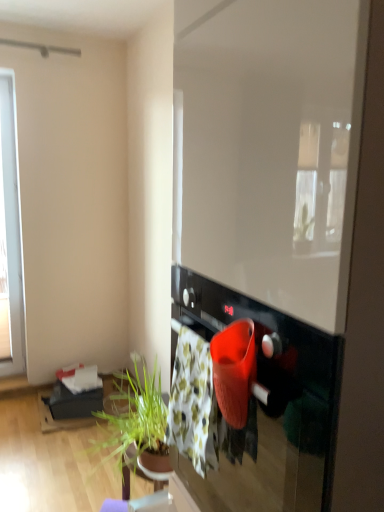
Question: In terms of width, does floral cotton blanket at center look wider or thinner when compared to transparent glass window screen at center?

Choices:
 (A) thin
 (B) wide

Answer: (A)

Question: From the image's perspective, is floral cotton blanket at center above or below transparent glass window screen at center?

Choices:
 (A) above
 (B) below

Answer: (B)

Question: Considering the real-world distances, which object is farthest from the black glossy oven at center?

Choices:
 (A) transparent glass window screen at center
 (B) floral cotton blanket at center

Answer: (A)

Question: Based on their relative distances, which object is nearer to the black glossy oven at center?

Choices:
 (A) transparent glass window screen at center
 (B) floral cotton blanket at center

Answer: (B)